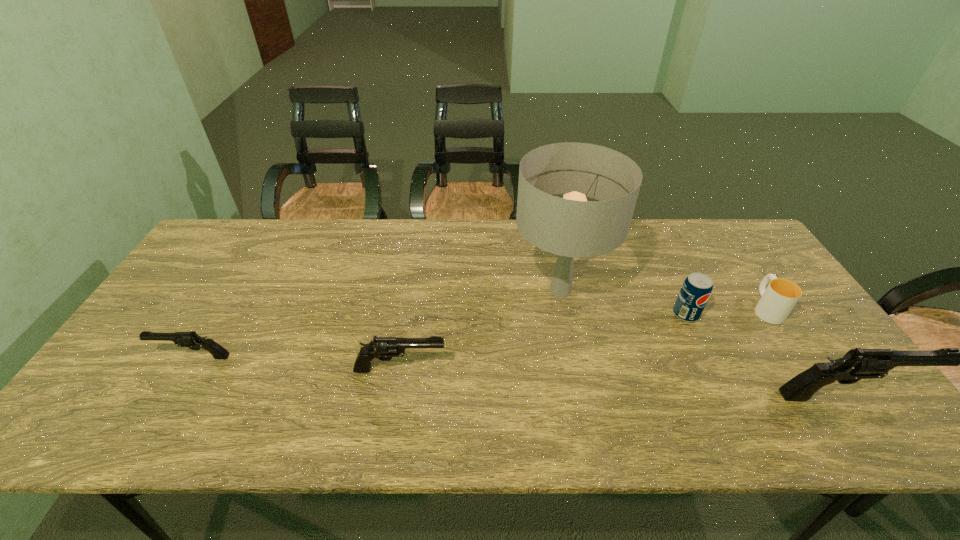
What are the coordinates of `free location located at the end of the barrel of the fourth farthest object` in the screenshot? It's located at (133, 357).

What are the coordinates of `free region located 0.270m at the end of the barrel of the second nearest gun` in the screenshot? It's located at (556, 369).

The image size is (960, 540). In order to click on vacant space located 0.300m on the left of the third object from right to left in this screenshot , I will do `click(564, 314)`.

This screenshot has width=960, height=540. What are the coordinates of `vacant space situated with the handle on the side of the cup` in the screenshot? It's located at (731, 255).

The height and width of the screenshot is (540, 960). Find the location of `free location located 0.290m with the handle on the side of the cup`. free location located 0.290m with the handle on the side of the cup is located at coordinates (717, 234).

Identify the location of vacant area located 0.100m with the handle on the side of the cup. The image size is (960, 540). (741, 271).

This screenshot has width=960, height=540. Find the location of `vacant area located 0.370m on the front-facing side of the tallest object`. vacant area located 0.370m on the front-facing side of the tallest object is located at coordinates (385, 291).

Find the location of a particular element. This screenshot has width=960, height=540. vacant position located on the front-facing side of the tallest object is located at coordinates (477, 291).

Locate an element on the screen. free space located on the front-facing side of the tallest object is located at coordinates (385, 291).

Where is `object that is at the far edge`? This screenshot has height=540, width=960. object that is at the far edge is located at coordinates (571, 227).